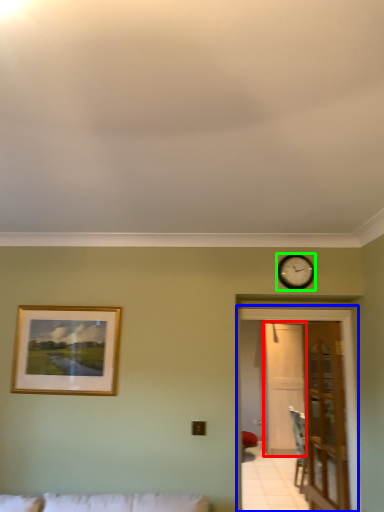
Question: Which is farther away from glass door (highlighted by a red box)? glass door (highlighted by a blue box) or wall clock (highlighted by a green box)?

Choices:
 (A) glass door
 (B) wall clock

Answer: (B)